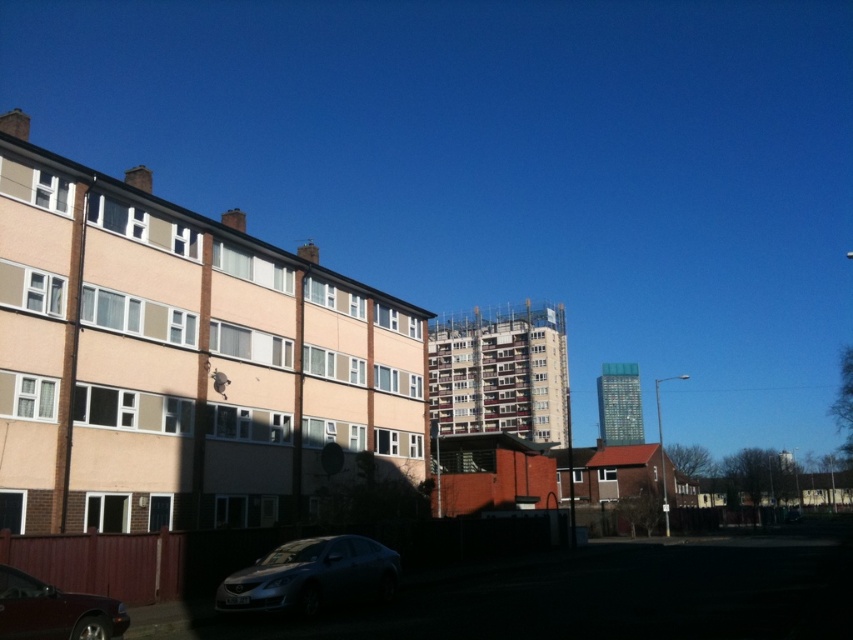
Question: Is satin silver sedan at lower center above shiny dark red car at lower left?

Choices:
 (A) yes
 (B) no

Answer: (B)

Question: Can you confirm if satin silver sedan at lower center is positioned below shiny dark red car at lower left?

Choices:
 (A) yes
 (B) no

Answer: (A)

Question: Among these points, which one is farthest from the camera?

Choices:
 (A) (283, 552)
 (B) (18, 588)

Answer: (A)

Question: Can you confirm if satin silver sedan at lower center is positioned below shiny dark red car at lower left?

Choices:
 (A) no
 (B) yes

Answer: (B)

Question: Which of the following is the closest to the observer?

Choices:
 (A) (107, 612)
 (B) (344, 582)

Answer: (A)